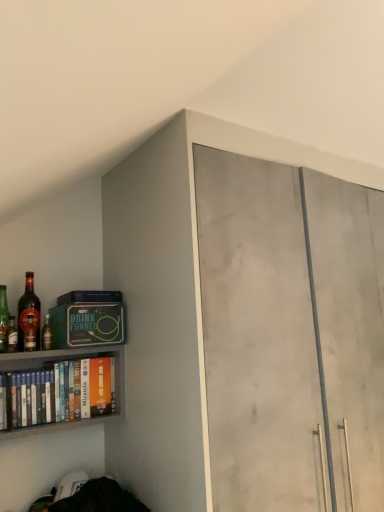
Question: Is matte glass bottle at left, the fourth bottle from the right, shorter than white matte book at left?

Choices:
 (A) yes
 (B) no

Answer: (A)

Question: Could white matte book at left be considered to be inside matte glass bottle at left, placed as the first bottle when sorted from left to right?

Choices:
 (A) no
 (B) yes

Answer: (A)

Question: From a real-world perspective, is matte glass bottle at left, placed as the first bottle when sorted from left to right, beneath white matte book at left?

Choices:
 (A) no
 (B) yes

Answer: (A)

Question: From the image's perspective, is matte glass bottle at left, placed as the first bottle when sorted from left to right, located beneath white matte book at left?

Choices:
 (A) yes
 (B) no

Answer: (B)

Question: Is matte glass bottle at left, the fourth bottle from the right, closer to the viewer compared to white matte book at left?

Choices:
 (A) no
 (B) yes

Answer: (A)

Question: In the image, is shiny brown glass bottle at left, the 3th bottle in the left-to-right sequence, positioned in front of or behind matte concrete cabinet at upper right?

Choices:
 (A) front
 (B) behind

Answer: (B)

Question: Is shiny brown glass bottle at left, the 3th bottle in the left-to-right sequence, to the left or to the right of matte concrete cabinet at upper right in the image?

Choices:
 (A) left
 (B) right

Answer: (A)

Question: Is point (34, 330) closer or farther from the camera than point (119, 179)?

Choices:
 (A) closer
 (B) farther

Answer: (A)

Question: Considering the positions of shiny brown glass bottle at left, the 3th bottle in the left-to-right sequence, and matte concrete cabinet at upper right in the image, is shiny brown glass bottle at left, the 3th bottle in the left-to-right sequence, bigger or smaller than matte concrete cabinet at upper right?

Choices:
 (A) small
 (B) big

Answer: (A)

Question: In terms of height, does matte glass bottle at left, positioned as the first bottle in right-to-left order, look taller or shorter compared to shiny glass bottle at left, marked as the 3th bottle in a right-to-left arrangement?

Choices:
 (A) tall
 (B) short

Answer: (B)

Question: Based on their positions, is matte glass bottle at left, which is the 4th bottle from left to right, located to the left or right of shiny glass bottle at left, marked as the 3th bottle in a right-to-left arrangement?

Choices:
 (A) left
 (B) right

Answer: (B)

Question: Considering the positions of matte glass bottle at left, positioned as the first bottle in right-to-left order, and shiny glass bottle at left, marked as the 3th bottle in a right-to-left arrangement, in the image, is matte glass bottle at left, positioned as the first bottle in right-to-left order, wider or thinner than shiny glass bottle at left, marked as the 3th bottle in a right-to-left arrangement,?

Choices:
 (A) wide
 (B) thin

Answer: (A)

Question: In the image, is matte glass bottle at left, positioned as the first bottle in right-to-left order, positioned in front of or behind shiny glass bottle at left, acting as the 2th bottle starting from the left?

Choices:
 (A) behind
 (B) front

Answer: (A)

Question: Looking at their shapes, would you say shiny glass bottle at left, marked as the 3th bottle in a right-to-left arrangement, is wider or thinner than white matte book at left?

Choices:
 (A) thin
 (B) wide

Answer: (A)

Question: Would you say shiny glass bottle at left, marked as the 3th bottle in a right-to-left arrangement, is inside or outside white matte book at left?

Choices:
 (A) outside
 (B) inside

Answer: (A)